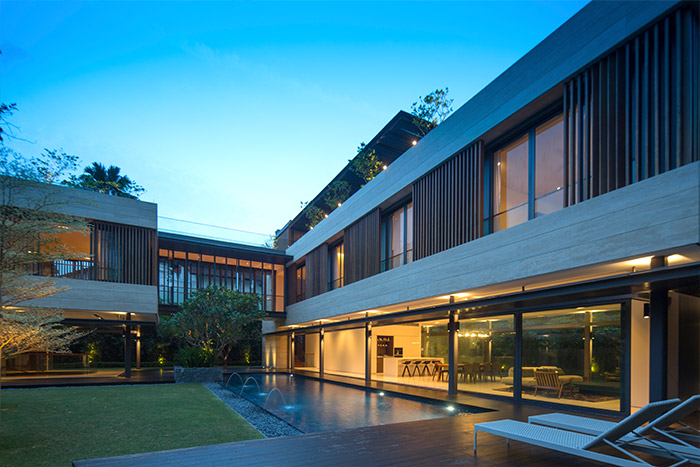
Image resolution: width=700 pixels, height=467 pixels. In order to click on window in this screenshot , I will do `click(518, 187)`, `click(396, 230)`, `click(339, 268)`, `click(297, 279)`, `click(194, 285)`, `click(63, 244)`.